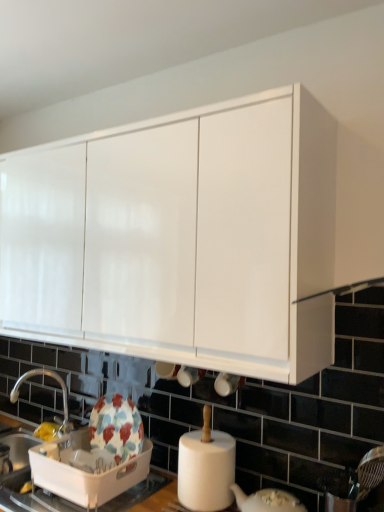
Question: Would you say floral ceramic dish drainer at lower left is inside or outside silver metallic tap at lower left?

Choices:
 (A) inside
 (B) outside

Answer: (B)

Question: Considering their positions, is floral ceramic dish drainer at lower left located in front of or behind silver metallic tap at lower left?

Choices:
 (A) behind
 (B) front

Answer: (B)

Question: Estimate the real-world distances between objects in this image. Which object is closer to the floral ceramic dish drainer at lower left?

Choices:
 (A) white glossy cabinet at upper center
 (B) silver metallic tap at lower left

Answer: (B)

Question: Considering the real-world distances, which object is closest to the silver metallic tap at lower left?

Choices:
 (A) white glossy cabinet at upper center
 (B) floral ceramic dish drainer at lower left

Answer: (B)